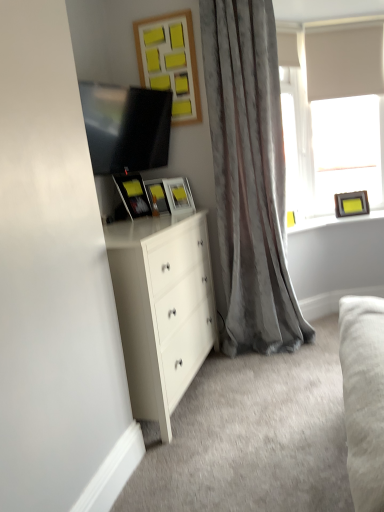
The width and height of the screenshot is (384, 512). In order to click on vacant area on top of yellow matte frame at upper right (from a real-world perspective) in this screenshot , I will do `click(349, 214)`.